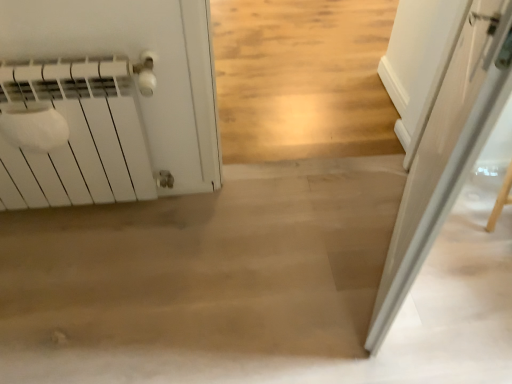
Image resolution: width=512 pixels, height=384 pixels. What do you see at coordinates (447, 151) in the screenshot?
I see `white glossy door at right` at bounding box center [447, 151].

Image resolution: width=512 pixels, height=384 pixels. Identify the location of white glossy door at right. (447, 151).

Find the location of a particular element. The image size is (512, 384). white glossy door at right is located at coordinates (x=447, y=151).